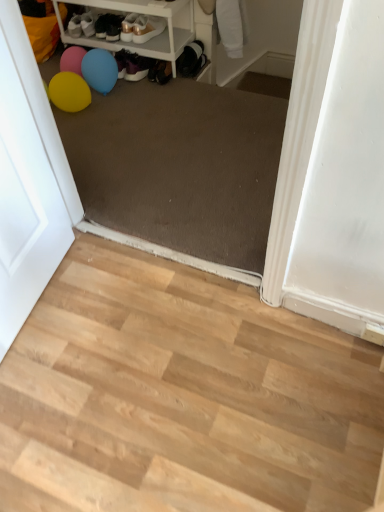
You are a GUI agent. You are given a task and a screenshot of the screen. Output one action in this format:
    pyautogui.click(x=<x>, y=<y>)
    Task: Click on the unoccupied region to the right of matte white screen door at left
    
    Given the screenshot: What is the action you would take?
    pyautogui.click(x=130, y=317)